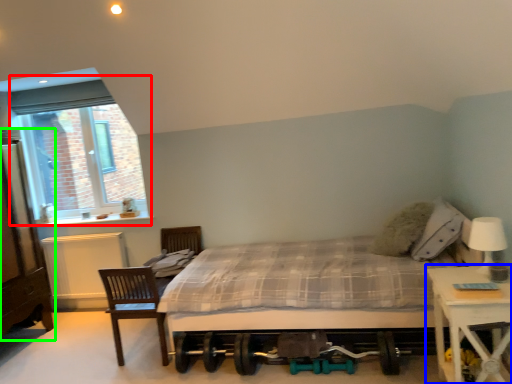
Question: Which object is the closest to the window (highlighted by a red box)? Choose among these: nightstand (highlighted by a blue box) or dresser (highlighted by a green box).

Choices:
 (A) nightstand
 (B) dresser

Answer: (B)